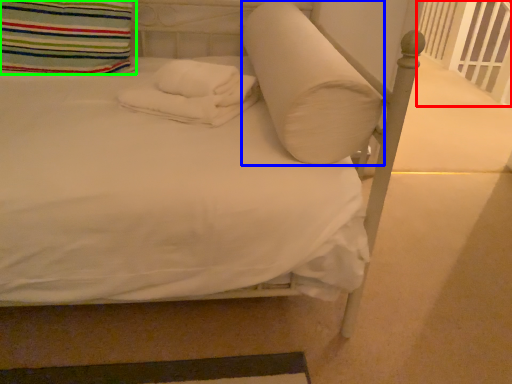
Question: Considering the real-world distances, which object is farthest from balustrade (highlighted by a red box)? pillow (highlighted by a blue box) or pillow (highlighted by a green box)?

Choices:
 (A) pillow
 (B) pillow

Answer: (B)